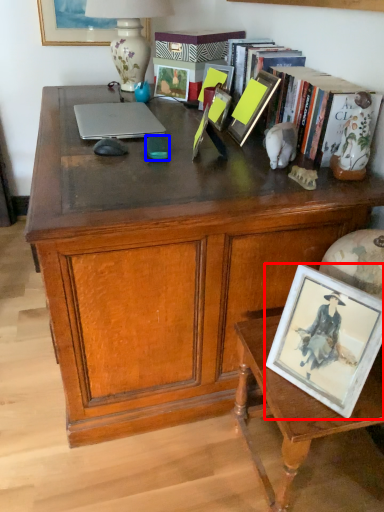
Question: Which object is further to the camera taking this photo, picture frame (highlighted by a red box) or mobile phone (highlighted by a blue box)?

Choices:
 (A) picture frame
 (B) mobile phone

Answer: (B)